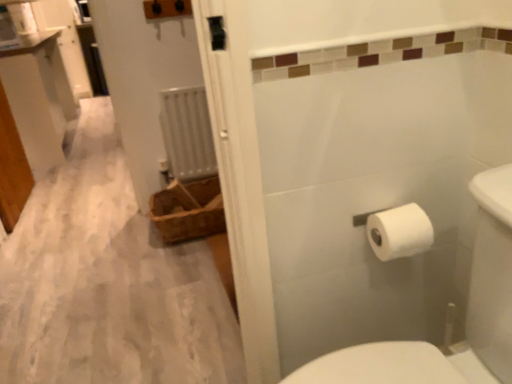
What is the approximate width of white paper towel at right?

white paper towel at right is 69.93 centimeters in width.

Locate an element on the screen. The image size is (512, 384). white metallic radiator at center is located at coordinates (187, 133).

In order to click on white matte toilet paper at right in this screenshot , I will do `click(399, 232)`.

The width and height of the screenshot is (512, 384). I want to click on basket that is under the white paper towel at right (from a real-world perspective), so [188, 210].

Which of these two, white paper towel at right or brown woven basket at left, stands taller?

Standing taller between the two is white paper towel at right.

From a real-world perspective, is white paper towel at right over brown woven basket at left?

Yes.

Based on the photo, considering the relative sizes of white paper towel at right and brown woven basket at left in the image provided, is white paper towel at right bigger than brown woven basket at left?

Yes.

You are a GUI agent. You are given a task and a screenshot of the screen. Output one action in this format:
    pyautogui.click(x=<x>, y=<y>)
    Task: Click on the radiator above the white paper towel at right (from the image's perspective)
    Image resolution: width=512 pixels, height=384 pixels.
    Given the screenshot: What is the action you would take?
    click(187, 133)

From the image's perspective, relative to white paper towel at right, is white metallic radiator at center above or below?

From the image's perspective, white metallic radiator at center appears above white paper towel at right.

Which object is further away from the camera taking this photo, white metallic radiator at center or white paper towel at right?

white metallic radiator at center is behind.

What's the angular difference between white metallic radiator at center and white paper towel at right's facing directions?

white metallic radiator at center and white paper towel at right are facing 91.6 degrees away from each other.

In terms of width, does white matte toilet paper at right look wider or thinner when compared to white metallic radiator at center?

Considering their sizes, white matte toilet paper at right looks broader than white metallic radiator at center.

From a real-world perspective, between white matte toilet paper at right and white metallic radiator at center, who is vertically higher?

In real-world perspective, white matte toilet paper at right is above.

Does white matte toilet paper at right appear on the left side of white metallic radiator at center?

No.

Would you consider white matte toilet paper at right to be distant from white metallic radiator at center?

Yes, white matte toilet paper at right is far from white metallic radiator at center.

Is white metallic radiator at center inside or outside of brown woven basket at left?

white metallic radiator at center lies outside brown woven basket at left.

Can you confirm if white metallic radiator at center is positioned to the right of brown woven basket at left?

Incorrect, white metallic radiator at center is not on the right side of brown woven basket at left.

Considering the positions of objects white metallic radiator at center and brown woven basket at left in the image provided, who is in front, white metallic radiator at center or brown woven basket at left?

brown woven basket at left is in front.

Considering the relative sizes of white metallic radiator at center and brown woven basket at left in the image provided, is white metallic radiator at center shorter than brown woven basket at left?

No.

Would you consider brown woven basket at left to be distant from white metallic radiator at center?

Actually, brown woven basket at left and white metallic radiator at center are a little close together.

From a real-world perspective, between brown woven basket at left and white metallic radiator at center, who is vertically lower?

From a 3D spatial view, brown woven basket at left is below.

Does brown woven basket at left have a lesser height compared to white metallic radiator at center?

Yes.

Visually, is white glossy vanity at upper left positioned to the left or to the right of white paper towel at right?

In the image, white glossy vanity at upper left appears on the left side of white paper towel at right.

Is point (3, 195) closer or farther from the camera than point (270, 141)?

Point (3, 195).

From the image's perspective, which is above, white glossy vanity at upper left or white paper towel at right?

white glossy vanity at upper left is shown above in the image.

Does brown woven basket at left lie behind white matte toilet paper at right?

That is True.

Is brown woven basket at left to the left of white matte toilet paper at right from the viewer's perspective?

Yes.

Can you confirm if brown woven basket at left is thinner than white matte toilet paper at right?

In fact, brown woven basket at left might be wider than white matte toilet paper at right.

Would you say brown woven basket at left contains white matte toilet paper at right?

No, white matte toilet paper at right is not surrounded by brown woven basket at left.

Locate an element on the screen. This screenshot has width=512, height=384. basket behind the white paper towel at right is located at coordinates (188, 210).

This screenshot has height=384, width=512. What are the coordinates of `radiator above the white paper towel at right (from the image's perspective)` in the screenshot? It's located at (187, 133).

Which object lies nearer to the anchor point brown woven basket at left, white matte toilet paper at right or white metallic radiator at center?

white metallic radiator at center is positioned closer to the anchor brown woven basket at left.

When comparing their distances from white paper towel at right, does white glossy vanity at upper left or white metallic radiator at center seem further?

Based on the image, white glossy vanity at upper left appears to be further to white paper towel at right.

Considering their positions, is white matte toilet paper at right positioned closer to white metallic radiator at center than white paper towel at right?

The object closer to white metallic radiator at center is white paper towel at right.

Considering their positions, is white metallic radiator at center positioned further to white glossy vanity at upper left than white matte toilet paper at right?

white matte toilet paper at right.

When comparing their distances from white matte toilet paper at right, does brown woven basket at left or white metallic radiator at center seem closer?

Among the two, brown woven basket at left is located nearer to white matte toilet paper at right.

Looking at the image, which one is located closer to brown woven basket at left, white matte toilet paper at right or white glossy vanity at upper left?

The object closer to brown woven basket at left is white glossy vanity at upper left.

Based on their spatial positions, is white metallic radiator at center or white glossy vanity at upper left further from white paper towel at right?

Based on the image, white glossy vanity at upper left appears to be further to white paper towel at right.

When comparing their distances from white metallic radiator at center, does white matte toilet paper at right or brown woven basket at left seem further?

white matte toilet paper at right is further to white metallic radiator at center.

Where is `toilet paper between white paper towel at right and white metallic radiator at center from front to back`? This screenshot has height=384, width=512. toilet paper between white paper towel at right and white metallic radiator at center from front to back is located at coordinates pos(399,232).

Locate an element on the screen. This screenshot has height=384, width=512. radiator located between white glossy vanity at upper left and white matte toilet paper at right in the left-right direction is located at coordinates (187, 133).

You are a GUI agent. You are given a task and a screenshot of the screen. Output one action in this format:
    pyautogui.click(x=<x>, y=<y>)
    Task: Click on the basket between white matte toilet paper at right and white metallic radiator at center from front to back
    Image resolution: width=512 pixels, height=384 pixels.
    Given the screenshot: What is the action you would take?
    pyautogui.click(x=188, y=210)

Image resolution: width=512 pixels, height=384 pixels. Identify the location of toilet paper between white paper towel at right and white glossy vanity at upper left along the z-axis. (399, 232).